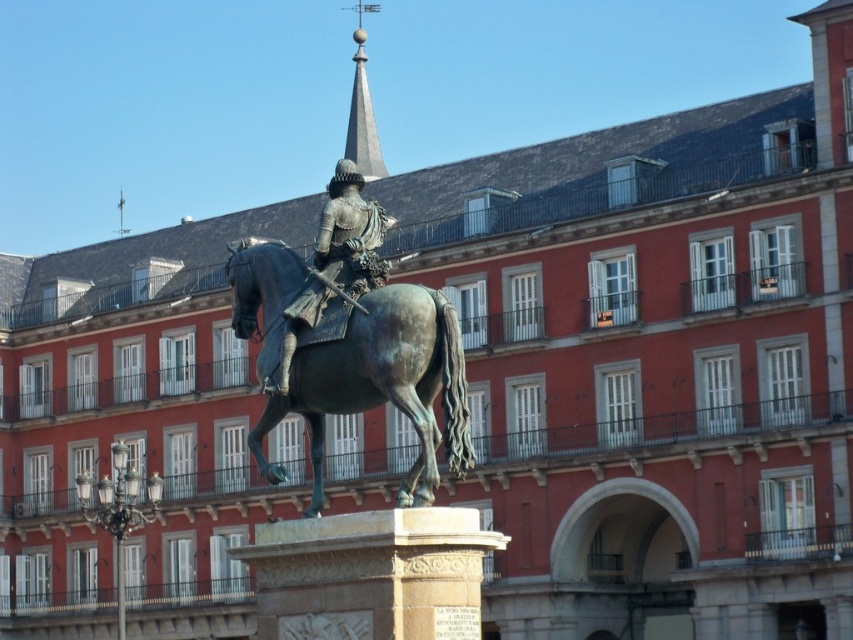
Which is behind, point (302, 333) or point (354, 90)?

Point (354, 90)

Does shiny bronze rider at center appear under polished gray spire at upper center?

Indeed, shiny bronze rider at center is positioned under polished gray spire at upper center.

Between point (340, 272) and point (355, 129), which one is positioned behind?

Point (355, 129)

Where is `shiny bronze rider at center`? The width and height of the screenshot is (853, 640). shiny bronze rider at center is located at coordinates (335, 262).

Does point (289, 252) come in front of point (345, 253)?

No, (289, 252) is behind (345, 253).

Is the position of bronze textured horse at center less distant than that of shiny bronze rider at center?

Yes.

Between point (337, 396) and point (350, 221), which one is positioned in front?

Point (337, 396)

At what (x,y) coordinates should I click in order to perform the action: click on bronze textured horse at center. Please return your answer as a coordinate pair (x, y). Looking at the image, I should click on (381, 385).

Based on the photo, which is below, bronze textured horse at center or polished gray spire at upper center?

bronze textured horse at center is below.

Measure the distance between bronze textured horse at center and polished gray spire at upper center.

bronze textured horse at center and polished gray spire at upper center are 62.04 meters apart from each other.

Is point (399, 369) positioned before point (364, 100)?

Yes, point (399, 369) is closer to viewer.

The height and width of the screenshot is (640, 853). What are the coordinates of `bronze textured horse at center` in the screenshot? It's located at (381, 385).